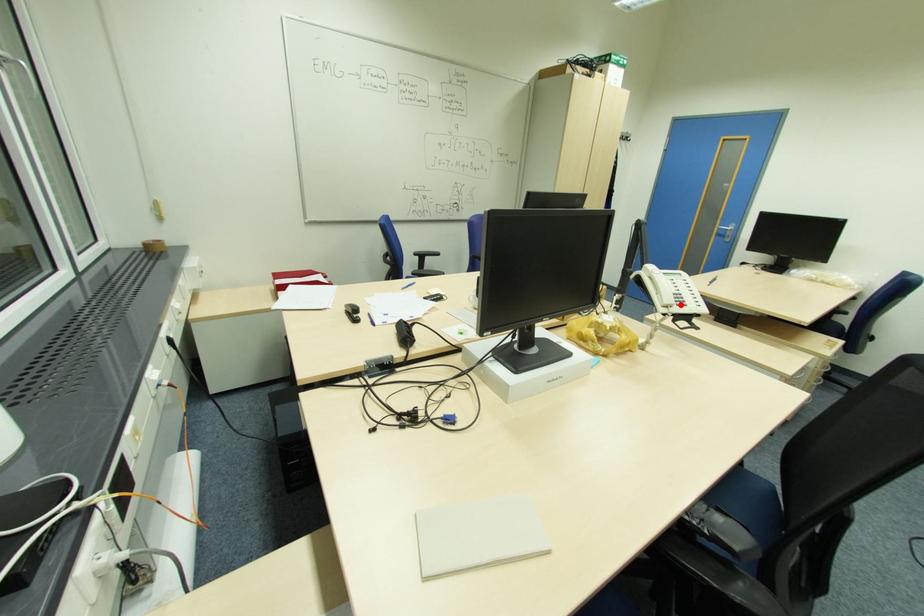
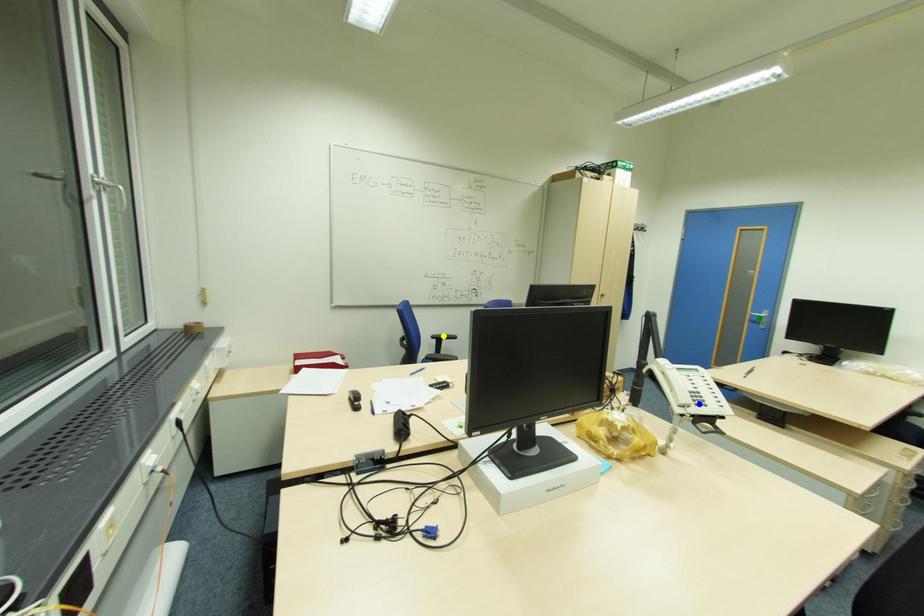
Question: I am providing you with two images of the same scene from different viewpoints. A red point is marked on the first image. You are given multiple points on the second image. In image 2, which mark is for the same physical point as the one in image 1?

Choices:
 (A) blue point
 (B) green point
 (C) yellow point

Answer: (A)